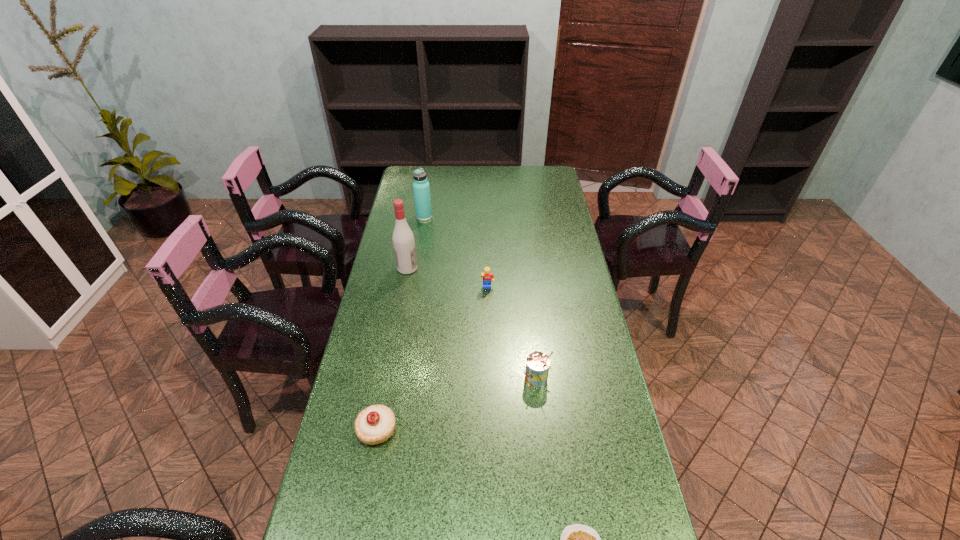
The height and width of the screenshot is (540, 960). Identify the location of the tallest object. click(x=403, y=240).

Where is `alcohol`? alcohol is located at coordinates (403, 240).

Locate an element on the screen. The height and width of the screenshot is (540, 960). the fifth shortest object is located at coordinates (421, 188).

What are the coordinates of `thermos bottle` in the screenshot? It's located at (421, 188).

Find the location of `can`. can is located at coordinates (537, 366).

You are a GUI agent. You are given a task and a screenshot of the screen. Output one action in this format:
    pyautogui.click(x=<x>, y=<y>)
    Task: Click on the third nearest object
    The image size is (960, 540).
    Given the screenshot: What is the action you would take?
    pyautogui.click(x=537, y=366)

Locate an element on the screen. The width and height of the screenshot is (960, 540). the fourth nearest object is located at coordinates (488, 277).

You are a GUI agent. You are given a task and a screenshot of the screen. Output one action in this format:
    pyautogui.click(x=<x>, y=<y>)
    Task: Click on the Lego
    This screenshot has width=960, height=540.
    Given the screenshot: What is the action you would take?
    pyautogui.click(x=488, y=277)

In order to click on pastry in this screenshot , I will do [375, 424].

Locate an element on the screen. The height and width of the screenshot is (540, 960). vacant space located 0.150m on the label of the tallest object is located at coordinates [x=459, y=268].